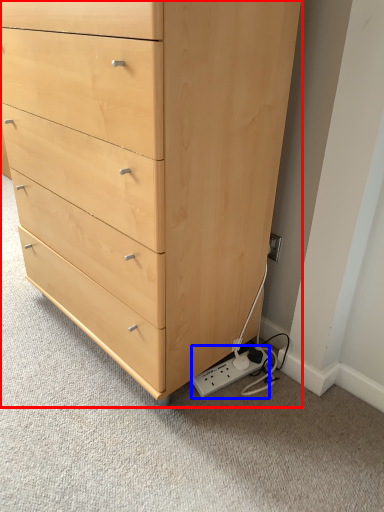
Question: Among these objects, which one is nearest to the camera, chest of drawers (highlighted by a red box) or plug (highlighted by a blue box)?

Choices:
 (A) chest of drawers
 (B) plug

Answer: (A)